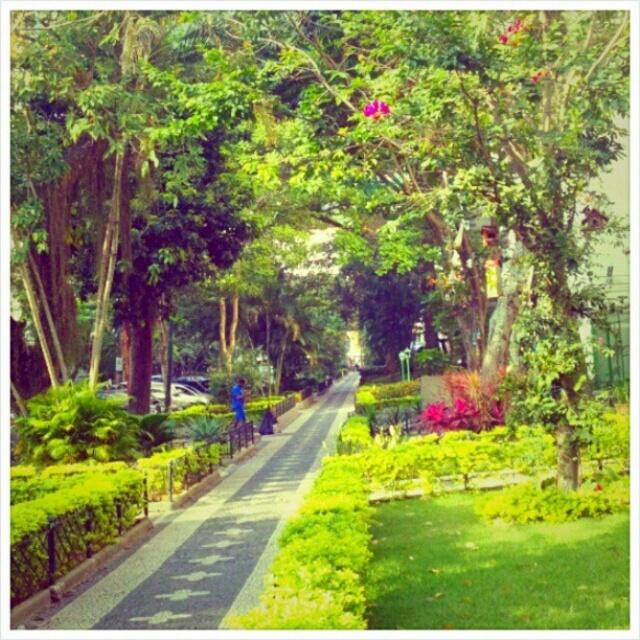
You are a gardener who needs to water both the green leafy tree at center and the pink matte flower at upper center. Your watering can has a range of 8 meters. Can you reach both plants without moving your position?

The green leafy tree at center is 8.35 meters from the pink matte flower at upper center. Since the watering can only reaches 8 meters, you cannot reach both plants without moving your position.

You are a gardener who needs to mow the green paved walkway at center. You have a lawnmower that is 1.2 meters wide. Can you mow the walkway without the lawnmower hitting the green leafy tree at center?

The green leafy tree at center might be wider than the green paved walkway at center. Since the lawnmower is 1.2 meters wide, if the walkway is narrower than 1.2 meters, the lawnmower cannot fit. However, if the walkway is wider than or equal to 1.2 meters, it can fit. But since the tree might be wider than the walkway, there is a possibility that the walkway is narrower than the tree, so the lawnmower might not fit. Therefore, it is uncertain whether the lawnmower can mow the walkway without hitting the t